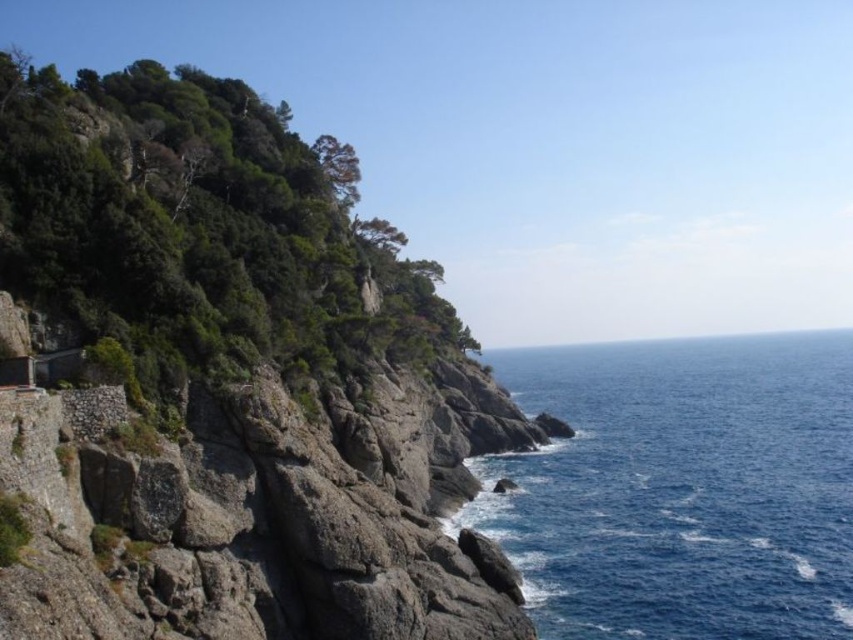
Question: Among these objects, which one is farthest from the camera?

Choices:
 (A) green leafy hillside at upper left
 (B) blue water at right

Answer: (B)

Question: Can you confirm if green leafy hillside at upper left is positioned to the right of blue water at right?

Choices:
 (A) yes
 (B) no

Answer: (B)

Question: Is green leafy hillside at upper left to the right of blue water at right from the viewer's perspective?

Choices:
 (A) yes
 (B) no

Answer: (B)

Question: Can you confirm if green leafy hillside at upper left is positioned to the left of blue water at right?

Choices:
 (A) no
 (B) yes

Answer: (B)